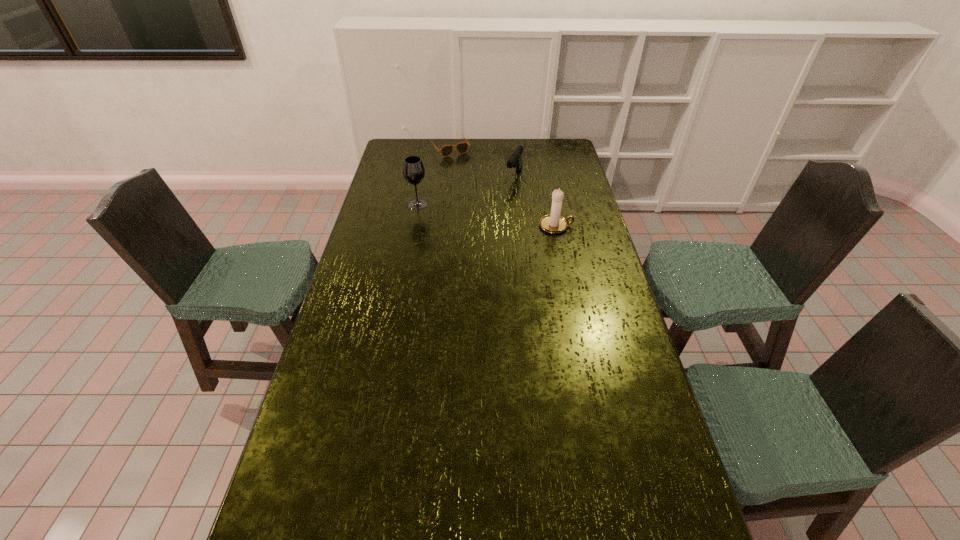
Find the location of a particular element. free point located 0.150m on the front-facing side of the pistol is located at coordinates (500, 201).

At what (x,y) coordinates should I click in order to perform the action: click on vacant space located on the front-facing side of the pistol. Please return your answer as a coordinate pair (x, y). The height and width of the screenshot is (540, 960). Looking at the image, I should click on (487, 221).

The height and width of the screenshot is (540, 960). What are the coordinates of `vacant space located on the front-facing side of the sunglasses` in the screenshot? It's located at (467, 170).

Find the location of a particular element. The image size is (960, 540). blank space located 0.150m on the front-facing side of the sunglasses is located at coordinates (468, 172).

The image size is (960, 540). In order to click on free space located 0.120m on the front-facing side of the sunglasses in this screenshot , I will do `click(466, 169)`.

The height and width of the screenshot is (540, 960). I want to click on object present at the far edge, so click(x=462, y=147).

Find the location of a particular element. Image resolution: width=960 pixels, height=540 pixels. object that is at the left edge is located at coordinates (413, 170).

The width and height of the screenshot is (960, 540). I want to click on object that is at the right edge, so click(554, 223).

Identify the location of free region at the left edge of the desktop. The width and height of the screenshot is (960, 540). (390, 175).

Find the location of a particular element. The height and width of the screenshot is (540, 960). free space at the right edge of the desktop is located at coordinates (641, 375).